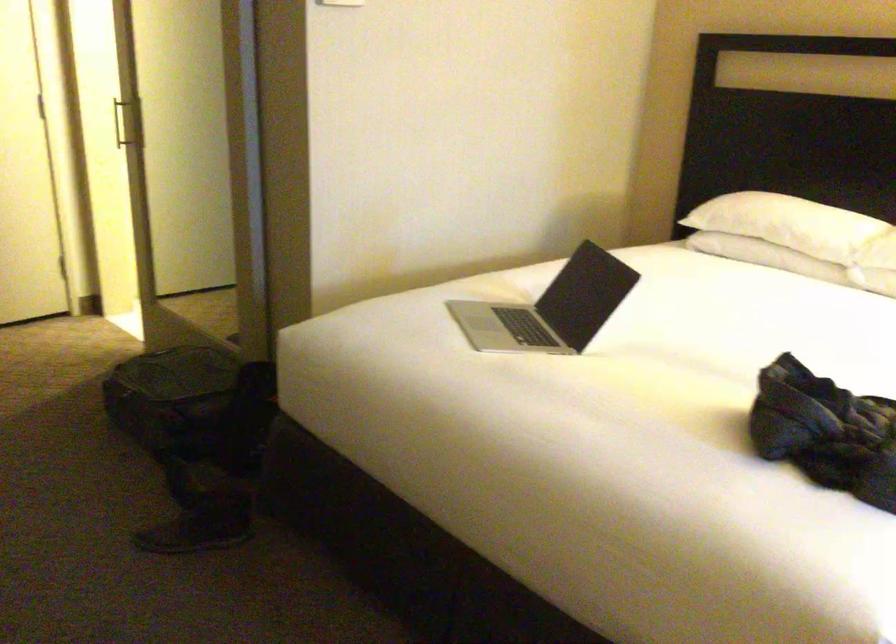
The height and width of the screenshot is (644, 896). What do you see at coordinates (825, 431) in the screenshot?
I see `a black travel bag` at bounding box center [825, 431].